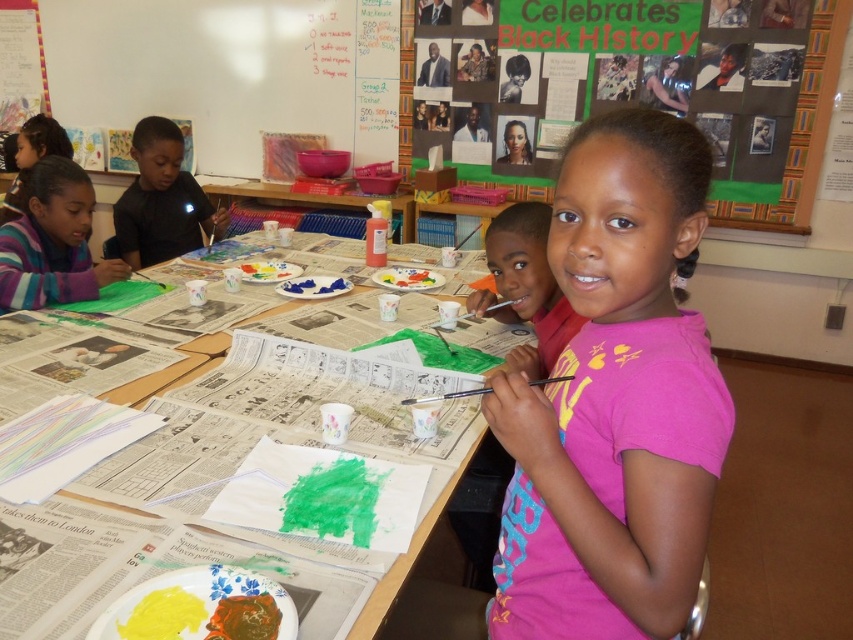
Question: Among these points, which one is farthest from the camera?

Choices:
 (A) (650, 157)
 (B) (228, 456)
 (C) (370, 200)

Answer: (C)

Question: Can you confirm if pink cotton shirt at center is bigger than black matte shirt at upper left?

Choices:
 (A) yes
 (B) no

Answer: (B)

Question: Estimate the real-world distances between objects in this image. Which object is farther from the plastic blue tray at center?

Choices:
 (A) green matte bulletin board at upper center
 (B) newspaper-covered table at center

Answer: (B)

Question: From the image, what is the correct spatial relationship of green matte bulletin board at upper center in relation to plastic blue tray at center?

Choices:
 (A) above
 (B) below

Answer: (A)

Question: Which point is farther to the camera?

Choices:
 (A) plastic blue tray at center
 (B) black matte shirt at upper left
 (C) newspaper-covered table at center

Answer: (A)

Question: Can you confirm if green matte bulletin board at upper center is positioned to the left of plastic blue tray at center?

Choices:
 (A) no
 (B) yes

Answer: (A)